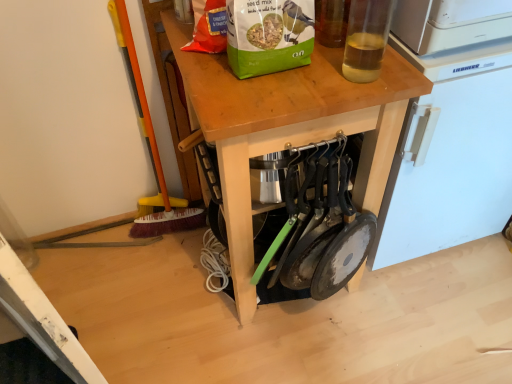
Find the location of a particular element. The image size is (512, 384). free spot to the left of translucent glass bottle at upper right is located at coordinates (296, 91).